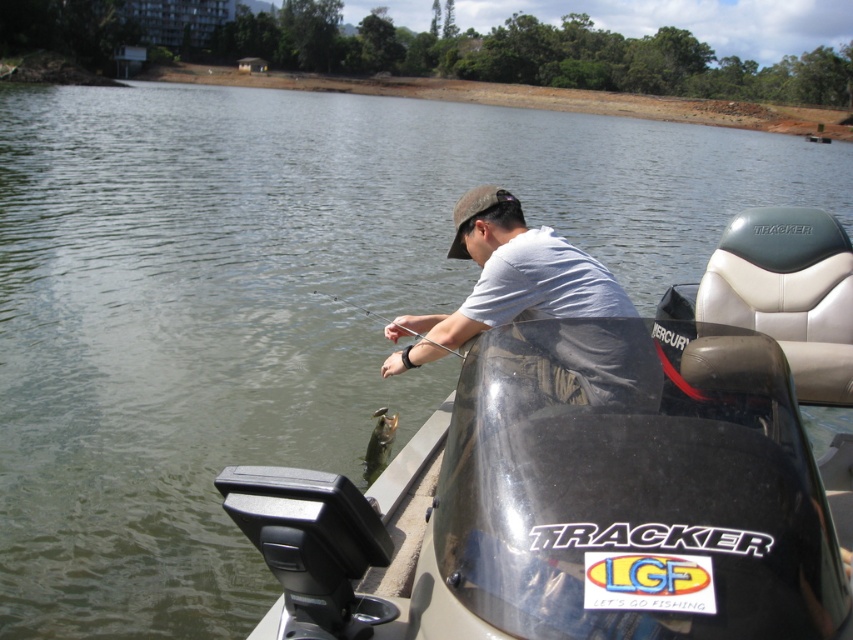
Is white matte shirt at center above shiny silver fish at lower center?

Correct, white matte shirt at center is located above shiny silver fish at lower center.

Between point (622, 324) and point (376, 458), which one is positioned behind?

Point (376, 458)

You are a GUI agent. You are given a task and a screenshot of the screen. Output one action in this format:
    pyautogui.click(x=<x>, y=<y>)
    Task: Click on the white matte shirt at center
    The height and width of the screenshot is (640, 853).
    Given the screenshot: What is the action you would take?
    pyautogui.click(x=508, y=280)